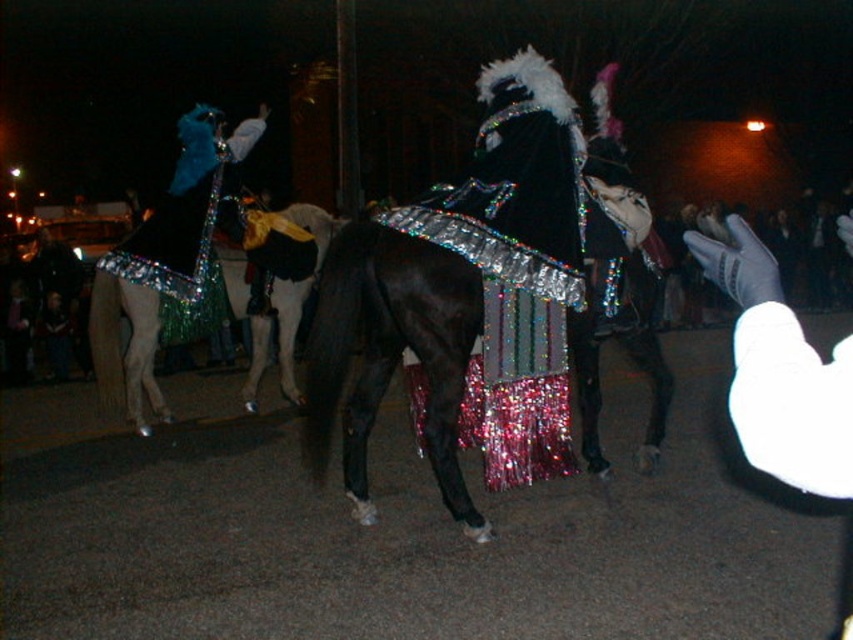
Which is below, holographic sequined cape at center or shiny metallic horse at center?

shiny metallic horse at center

Which is above, holographic sequined cape at center or shiny metallic horse at center?

holographic sequined cape at center is higher up.

Describe the element at coordinates (517, 266) in the screenshot. I see `holographic sequined cape at center` at that location.

The image size is (853, 640). What are the coordinates of `holographic sequined cape at center` in the screenshot? It's located at (517, 266).

Does shiny green fabric cape at left appear under shiny silver horse at center?

No, shiny green fabric cape at left is not below shiny silver horse at center.

Can you confirm if shiny green fabric cape at left is thinner than shiny silver horse at center?

In fact, shiny green fabric cape at left might be wider than shiny silver horse at center.

Where is `shiny green fabric cape at left`? shiny green fabric cape at left is located at coordinates (189, 227).

Is shiny green fabric cape at left positioned before shiny metallic horse at center?

No, shiny green fabric cape at left is further to the viewer.

Where is `shiny green fabric cape at left`? This screenshot has width=853, height=640. shiny green fabric cape at left is located at coordinates (189, 227).

Is point (216, 120) closer to camera compared to point (579, 348)?

No, it is behind (579, 348).

Image resolution: width=853 pixels, height=640 pixels. I want to click on shiny green fabric cape at left, so click(x=189, y=227).